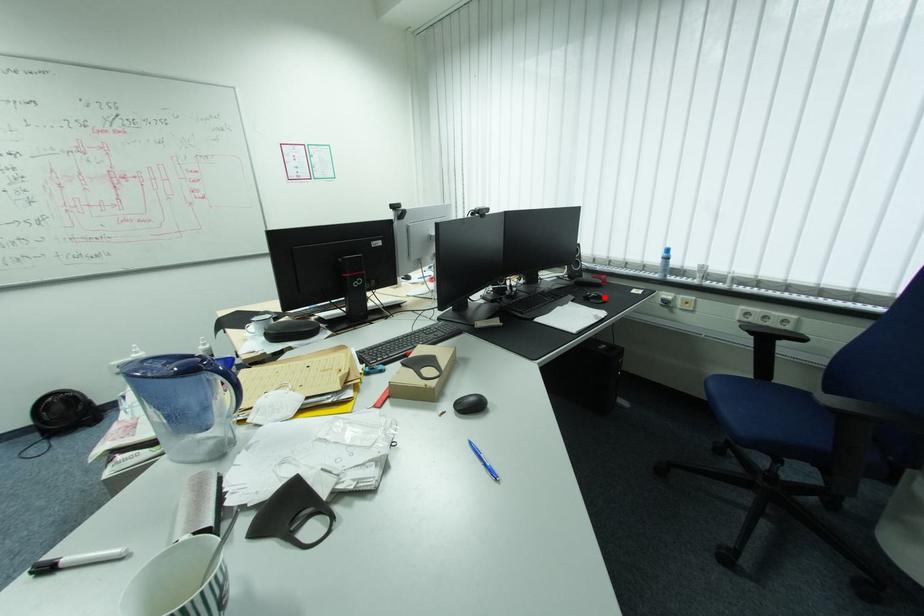
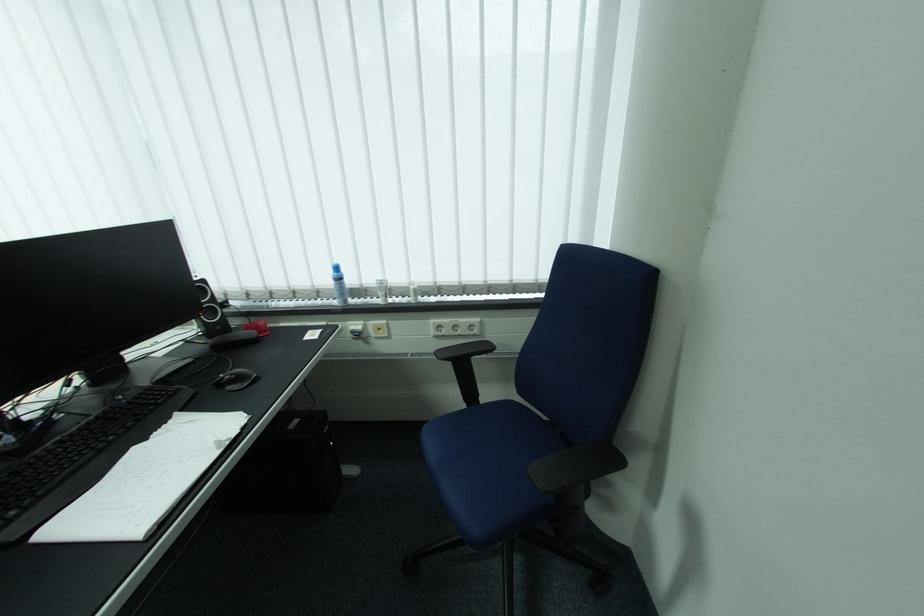
Find the pixel in the second image that matches the highlighted location in the first image.

(245, 379)